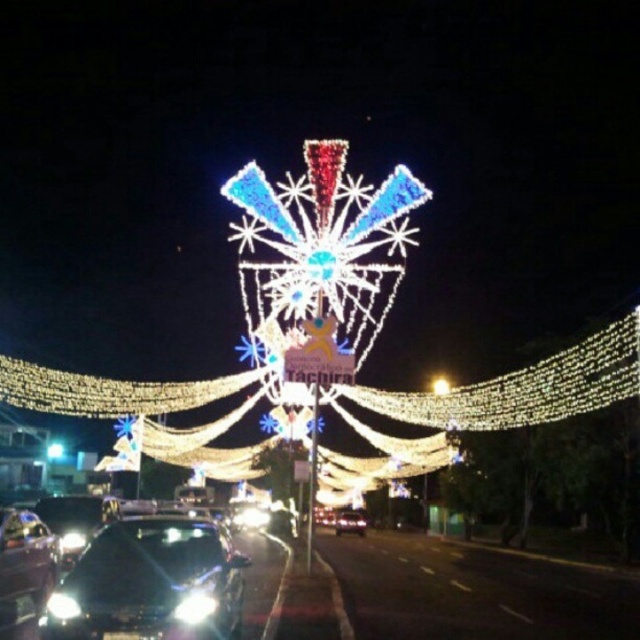
You are driving a glossy black car at center and need to park it in a space that can only accommodate vehicles up to the width of the illuminated starburst at center. Can your car fit in the parking space?

The glossy black car at center might be wider than the illuminated starburst at center, so there is a possibility that the car may not fit within the parking space designed for the starburst width.

You are standing at the camera position and want to take a photo of the glossy black car at center. The camera has a maximum focus range of 200 meters. Will the car be in focus?

The glossy black car at center and camera are 215.83 meters apart, which exceeds the camera maximum focus range of 200 meters. Therefore, the car will not be in focus.

You are a photographer setting up a tripod to capture the festive lights. You notice two cars in the frame, the shiny black car at lower left and the glossy black car at center. Which car appears taller in the photo?

The shiny black car at lower left appears taller than the glossy black car at center in the photo.